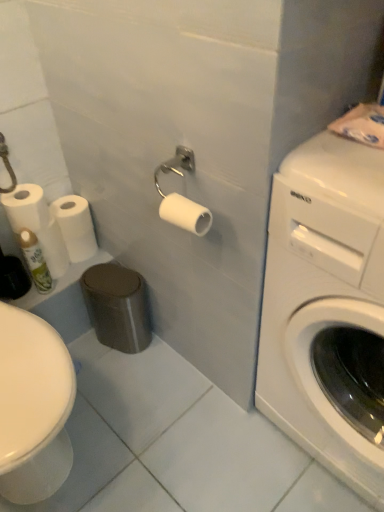
Question: Is white matte toilet paper at center, which appears as the first toilet paper when viewed from the right, turned away from white matte toilet paper at left, acting as the 3th toilet paper starting from the right?

Choices:
 (A) yes
 (B) no

Answer: (B)

Question: From a real-world perspective, is white matte toilet paper at center, the 3th toilet paper when ordered from back to front, on white matte toilet paper at left, which is counted as the 2th toilet paper, starting from the back?

Choices:
 (A) yes
 (B) no

Answer: (A)

Question: Could you tell me if white matte toilet paper at center, which is counted as the third toilet paper, starting from the left, is turned towards white matte toilet paper at left, positioned as the 1th toilet paper in left-to-right order?

Choices:
 (A) yes
 (B) no

Answer: (B)

Question: Does white matte toilet paper at center, which appears as the first toilet paper when viewed from the right, come in front of white matte toilet paper at left, which is counted as the 2th toilet paper, starting from the back?

Choices:
 (A) no
 (B) yes

Answer: (B)

Question: From the image's perspective, is white matte toilet paper at center, which is counted as the third toilet paper, starting from the left, under white matte toilet paper at left, marked as the 2th toilet paper in a front-to-back arrangement?

Choices:
 (A) yes
 (B) no

Answer: (A)

Question: From the image's perspective, is white glossy washing machine at right located above or below green matte spray can at lower left?

Choices:
 (A) above
 (B) below

Answer: (B)

Question: Is white glossy washing machine at right to the left or to the right of green matte spray can at lower left in the image?

Choices:
 (A) left
 (B) right

Answer: (B)

Question: Considering the positions of white glossy washing machine at right and green matte spray can at lower left in the image, is white glossy washing machine at right taller or shorter than green matte spray can at lower left?

Choices:
 (A) tall
 (B) short

Answer: (A)

Question: Is white glossy washing machine at right in front of or behind green matte spray can at lower left in the image?

Choices:
 (A) behind
 (B) front

Answer: (B)

Question: Looking at their shapes, would you say white matte toilet paper at left, placed as the second toilet paper when sorted from left to right, is wider or thinner than green matte spray can at lower left?

Choices:
 (A) thin
 (B) wide

Answer: (B)

Question: Relative to green matte spray can at lower left, is white matte toilet paper at left, the 1th toilet paper in the back-to-front sequence, in front or behind?

Choices:
 (A) front
 (B) behind

Answer: (B)

Question: From a real-world perspective, is white matte toilet paper at left, the 1th toilet paper in the back-to-front sequence, physically located above or below green matte spray can at lower left?

Choices:
 (A) above
 (B) below

Answer: (B)

Question: Would you say white matte toilet paper at left, placed as the second toilet paper when sorted from left to right, is to the left or to the right of green matte spray can at lower left in the picture?

Choices:
 (A) right
 (B) left

Answer: (A)

Question: Based on their sizes in the image, would you say white glossy washing machine at right is bigger or smaller than white matte toilet paper at left, placed as the second toilet paper when sorted from right to left?

Choices:
 (A) small
 (B) big

Answer: (B)

Question: From their relative heights in the image, would you say white glossy washing machine at right is taller or shorter than white matte toilet paper at left, arranged as the 3th toilet paper when viewed from the front?

Choices:
 (A) short
 (B) tall

Answer: (B)